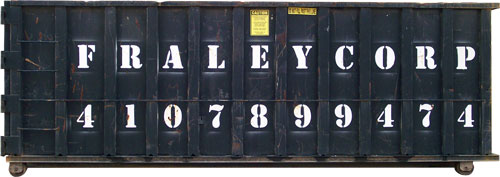
The width and height of the screenshot is (500, 177). Identify the location of stencil. (83, 55), (92, 48), (90, 57).